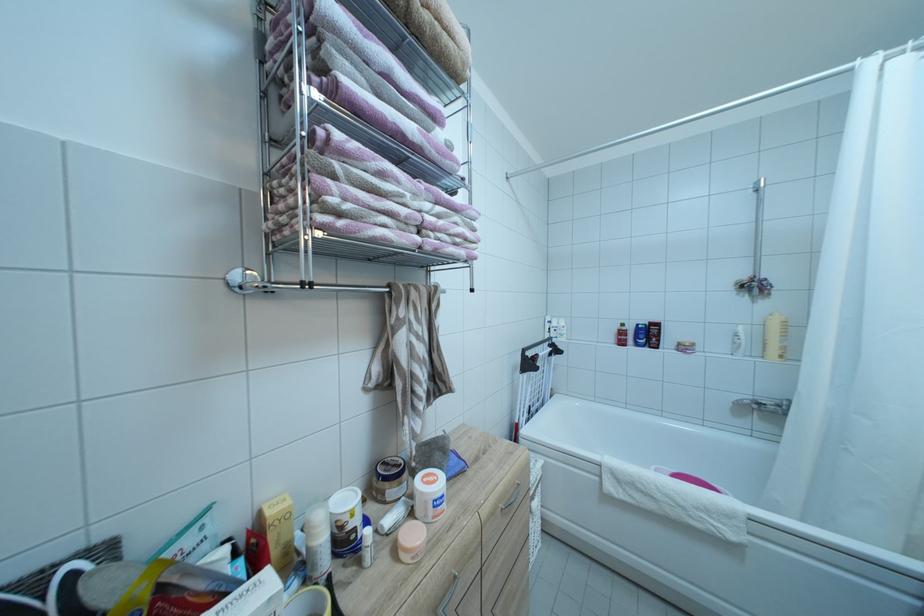
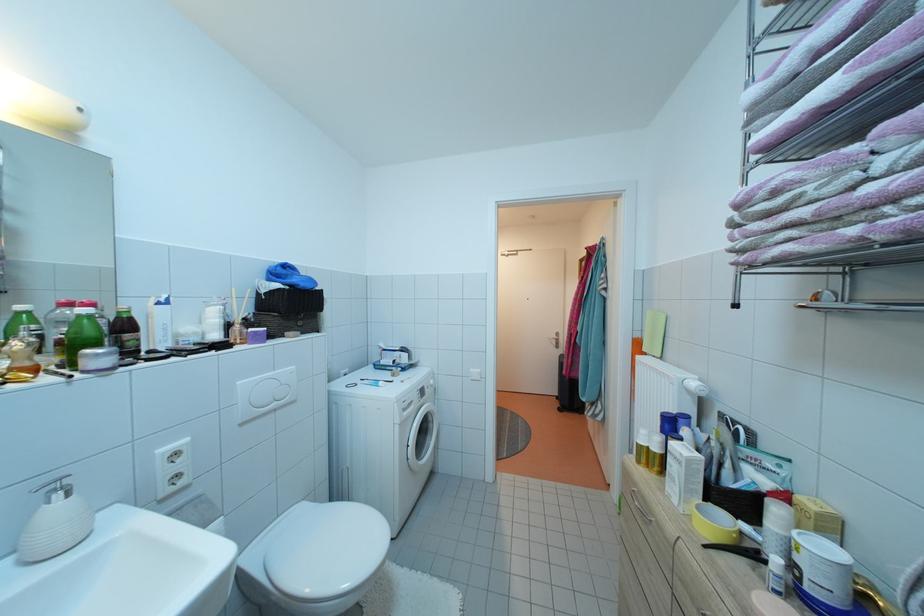
Find the pixel in the second image that matches [357,532] in the first image.

(805, 565)